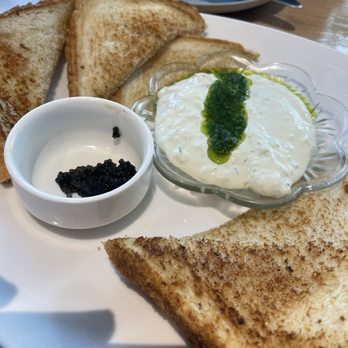
This screenshot has width=348, height=348. What are the coordinates of `brown tabletop` in the screenshot? It's located at (318, 20).